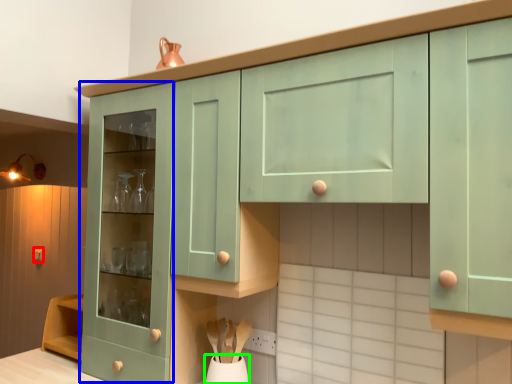
Question: Which object is positioned closest to knob (highlighted by a red box)? Select from cabinetry (highlighted by a blue box) and vase (highlighted by a green box).

Choices:
 (A) cabinetry
 (B) vase

Answer: (A)